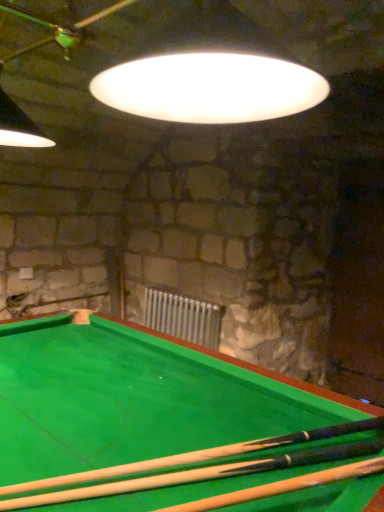
Question: Can you confirm if metallic silver radiator at center is positioned to the right of wooden cue at bottom?

Choices:
 (A) yes
 (B) no

Answer: (B)

Question: Does metallic silver radiator at center have a lesser height compared to wooden cue at bottom?

Choices:
 (A) no
 (B) yes

Answer: (A)

Question: From a real-world perspective, does metallic silver radiator at center stand above wooden cue at bottom?

Choices:
 (A) yes
 (B) no

Answer: (B)

Question: Would you say metallic silver radiator at center is outside wooden cue at bottom?

Choices:
 (A) no
 (B) yes

Answer: (B)

Question: Is metallic silver radiator at center to the left of wooden cue at bottom from the viewer's perspective?

Choices:
 (A) yes
 (B) no

Answer: (A)

Question: Considering the relative sizes of metallic silver radiator at center and wooden cue at bottom in the image provided, is metallic silver radiator at center wider than wooden cue at bottom?

Choices:
 (A) yes
 (B) no

Answer: (B)

Question: Does wooden cue at bottom have a smaller size compared to metallic silver radiator at center?

Choices:
 (A) no
 (B) yes

Answer: (B)

Question: From the image's perspective, is wooden cue at bottom on metallic silver radiator at center?

Choices:
 (A) no
 (B) yes

Answer: (B)

Question: Does wooden cue at bottom have a lesser width compared to metallic silver radiator at center?

Choices:
 (A) no
 (B) yes

Answer: (A)

Question: Is wooden cue at bottom surrounding metallic silver radiator at center?

Choices:
 (A) yes
 (B) no

Answer: (B)

Question: Can we say wooden cue at bottom lies outside metallic silver radiator at center?

Choices:
 (A) no
 (B) yes

Answer: (B)

Question: From a real-world perspective, is wooden cue at bottom physically above metallic silver radiator at center?

Choices:
 (A) yes
 (B) no

Answer: (A)

Question: In the image, is wooden cue at bottom positioned in front of or behind metallic silver radiator at center?

Choices:
 (A) behind
 (B) front

Answer: (B)